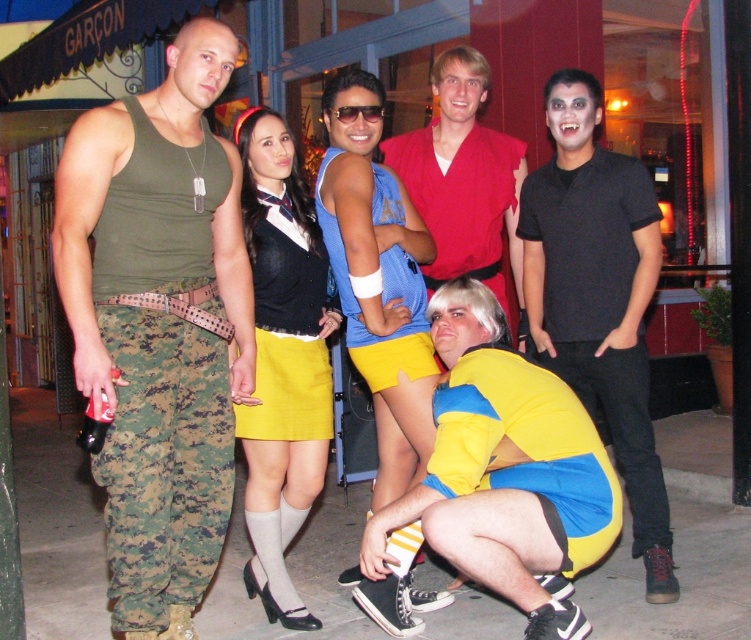
Question: Is red velvet shirt at center smaller than yellow fabric skirt at center?

Choices:
 (A) no
 (B) yes

Answer: (A)

Question: Which of the following is the farthest from the observer?

Choices:
 (A) (318, 365)
 (B) (279, 170)
 (C) (336, 284)

Answer: (C)

Question: Which object appears farthest from the camera in this image?

Choices:
 (A) yellow matte shorts at lower center
 (B) matte blue tank top at center
 (C) blue jersey at center

Answer: (C)

Question: Which of the following is the farthest from the observer?

Choices:
 (A) matte yellow skirt at center
 (B) black matte shirt at right
 (C) black plastic sunglasses at center

Answer: (C)

Question: From the image, what is the correct spatial relationship of matte yellow skirt at center in relation to matte blue tank top at center?

Choices:
 (A) above
 (B) below

Answer: (B)

Question: Is camouflage pants at left thinner than blue jersey at center?

Choices:
 (A) no
 (B) yes

Answer: (A)